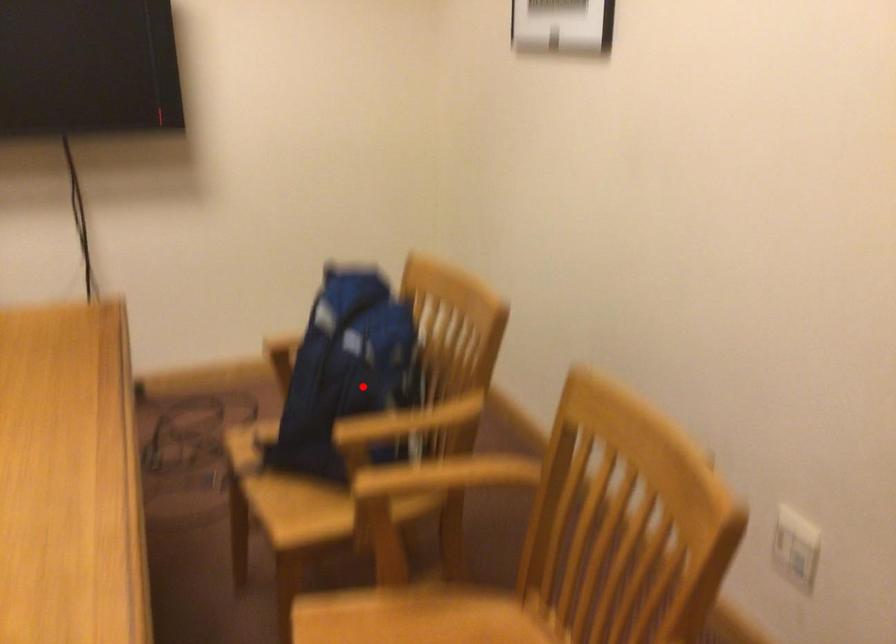
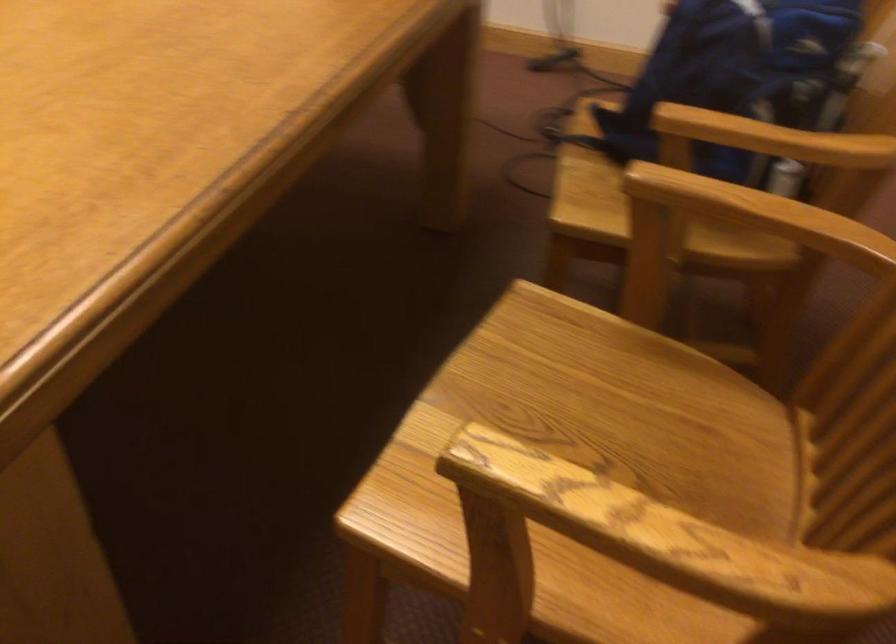
Find the pixel in the second image that matches the highlighted location in the first image.

(736, 73)